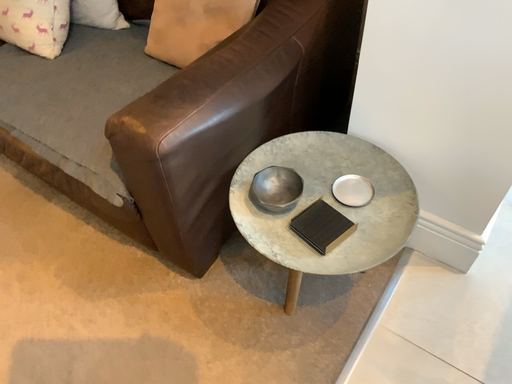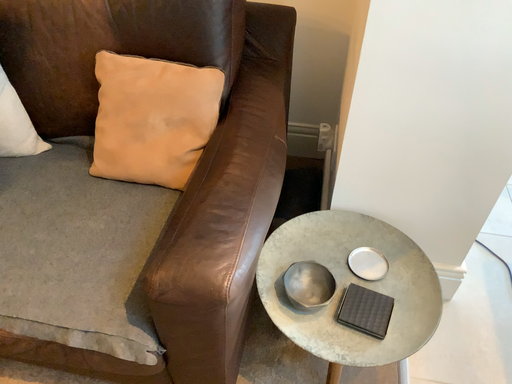
Question: How did the camera likely rotate when shooting the video?

Choices:
 (A) rotated left
 (B) rotated right

Answer: (B)